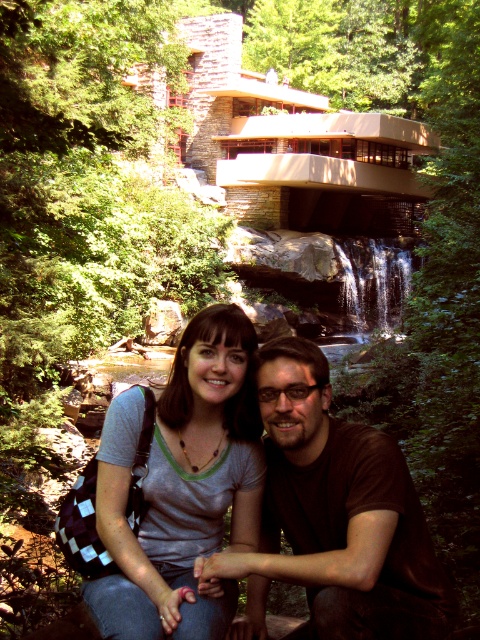
You are standing at the point labeled as point (x=252, y=467) and want to move to the point labeled as point (x=325, y=584). Is the destination point in front of or behind your current position?

The destination point labeled as point (x=325, y=584) is in front of your current position at point (x=252, y=467).